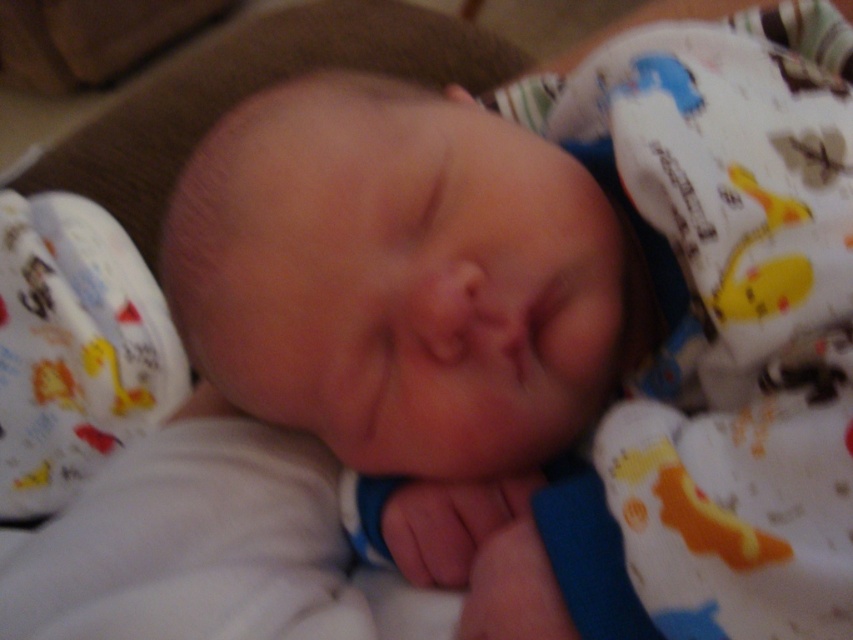
You are a photographer taking a close up shot of the white soft newborn at center. You want to ensure the newborn is in focus while the background is blurred. If your camera has a depth of field setting, what should you adjust to achieve this effect?

To achieve a blurred background while keeping the white soft newborn at center in focus, you should use a shallow depth of field. This can be done by setting your camera to a wide aperture, such as f1.8 or lower, which narrows the area in focus and blurs the background.

You are a parent holding a white soft newborn at center and a white cotton blanket at center. Which item can you place in the baby crib without needing to fold it first?

The white cotton blanket at center can be placed in the baby crib without folding first because it is larger than the white soft newborn at center.

You are a nurse checking on a newborn in the nursery. You see the white soft newborn at center and the white cotton blanket at center. Is there enough space between the newborn and the blanket to prevent suffocation?

The distance between the white soft newborn at center and the white cotton blanket at center is 2.86 inches. The American Academy of Pediatrics recommends keeping soft objects and loose bedding at least 2 inches away from an infant to reduce the risk of suffocation. Therefore, the current distance of 2.86 inches meets the safety guideline and is sufficient to prevent suffocation.